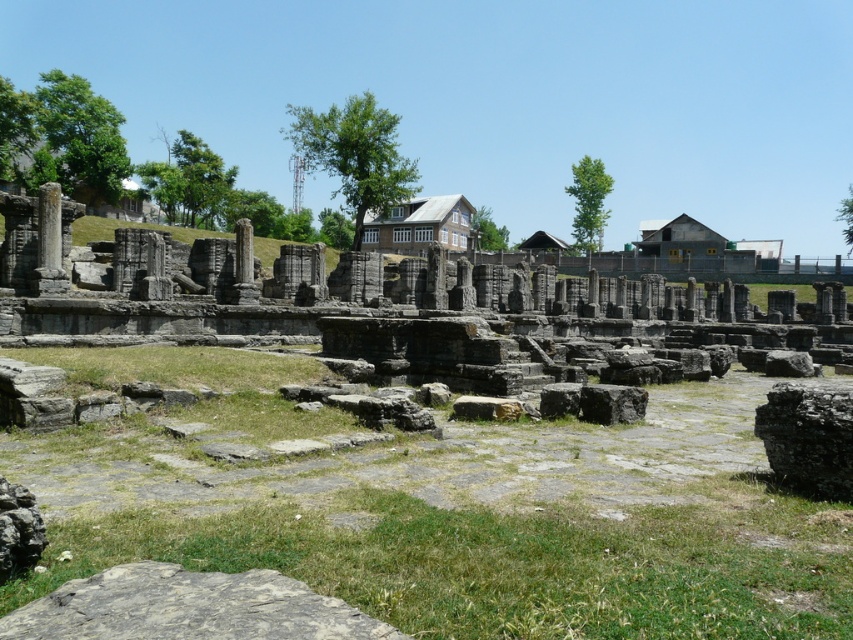
Question: Is green grass at lower center bigger than black stone at center?

Choices:
 (A) yes
 (B) no

Answer: (A)

Question: Among these objects, which one is nearest to the camera?

Choices:
 (A) rusty stone ruins at center
 (B) gray rough stone at center

Answer: (A)

Question: Which object appears closest to the camera in this image?

Choices:
 (A) gray rough stone at lower right
 (B) black stone at center
 (C) gray rough stone at center
 (D) gray rough stone at lower left

Answer: (D)

Question: Can you confirm if green grass at lower center is wider than gray rough stone at lower right?

Choices:
 (A) yes
 (B) no

Answer: (A)

Question: Is rusty stone ruins at center thinner than gray rough stone at lower left?

Choices:
 (A) no
 (B) yes

Answer: (A)

Question: Among these objects, which one is farthest from the camera?

Choices:
 (A) green grass at lower center
 (B) gray rough stone at lower right

Answer: (B)